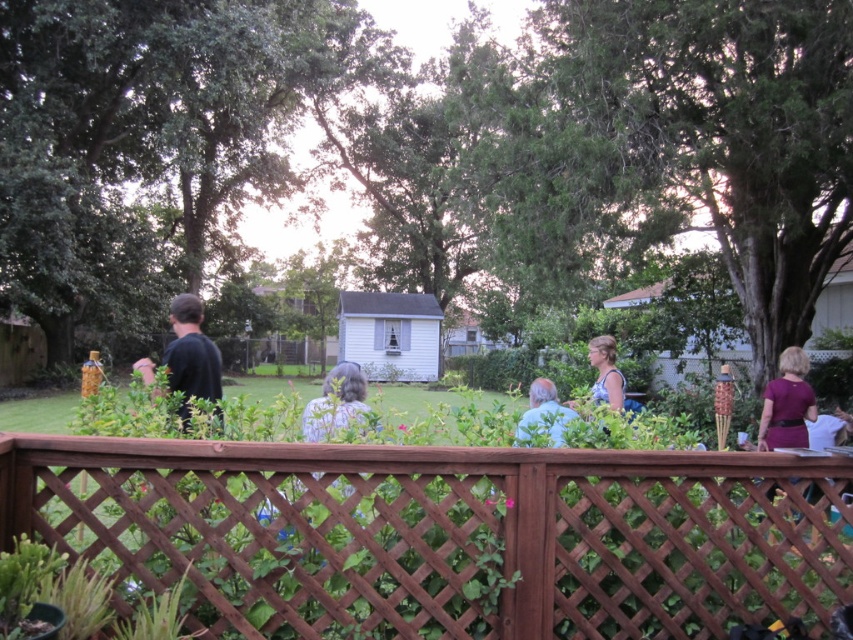
Question: Which point is closer to the camera?

Choices:
 (A) dark blue shirt at left
 (B) gray hair at center

Answer: (B)

Question: Is the position of gray hair at center less distant than that of light blue shirt at center?

Choices:
 (A) yes
 (B) no

Answer: (B)

Question: Which object is the farthest from the gray hair at center?

Choices:
 (A) brown wooden fence at center
 (B) purple fabric dress at right
 (C) blue denim dress at center

Answer: (B)

Question: Can you confirm if dark blue shirt at left is wider than light blue shirt at center?

Choices:
 (A) no
 (B) yes

Answer: (B)

Question: Does dark blue shirt at left have a lesser width compared to purple fabric dress at right?

Choices:
 (A) no
 (B) yes

Answer: (A)

Question: Which point appears farthest from the camera in this image?

Choices:
 (A) (189, 356)
 (B) (531, 385)

Answer: (B)